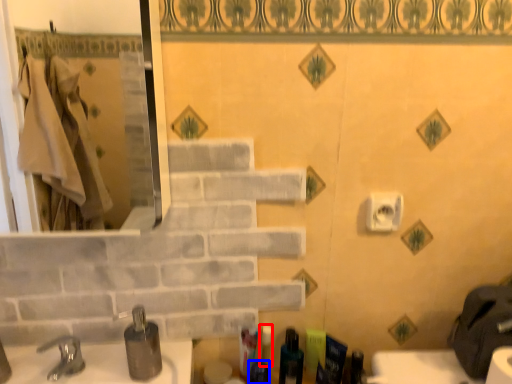
Question: Which of the following is the closest to the observer, toiletry (highlighted by a red box) or toiletry (highlighted by a blue box)?

Choices:
 (A) toiletry
 (B) toiletry

Answer: (B)